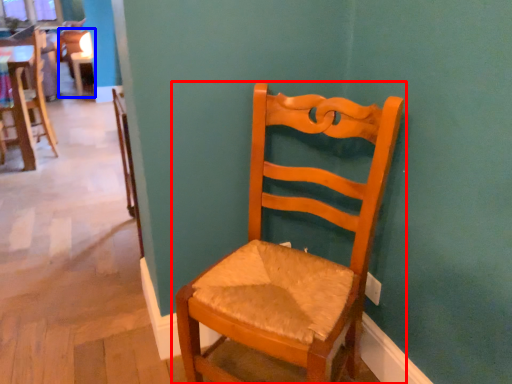
Question: Among these objects, which one is farthest to the camera, chair (highlighted by a red box) or chair (highlighted by a blue box)?

Choices:
 (A) chair
 (B) chair

Answer: (B)